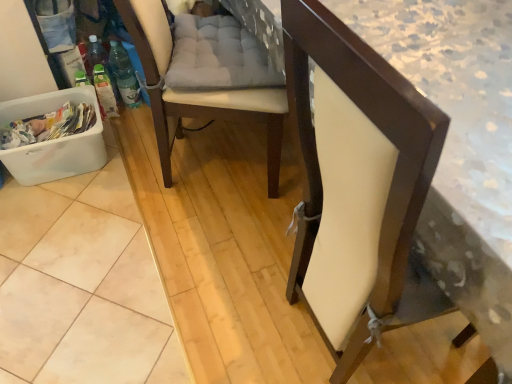
This screenshot has height=384, width=512. Describe the element at coordinates (365, 192) in the screenshot. I see `matte white chair at center, the 2th chair in the left-to-right sequence` at that location.

The width and height of the screenshot is (512, 384). I want to click on white plastic laundry basket at lower left, so click(53, 140).

Which object is further away from the camera, white leather chair at center, which is the first chair from left to right, or matte white chair at center, which is the 1th chair in right-to-left order?

white leather chair at center, which is the first chair from left to right, is more distant.

Could you measure the distance between white leather chair at center, which is the first chair from left to right, and matte white chair at center, the 2th chair in the left-to-right sequence?

white leather chair at center, which is the first chair from left to right, and matte white chair at center, the 2th chair in the left-to-right sequence, are 25.29 inches apart from each other.

From a real-world perspective, between white leather chair at center, which is the first chair from left to right, and matte white chair at center, the 2th chair in the left-to-right sequence, who is vertically lower?

white leather chair at center, which is the first chair from left to right.

Which is farther, (x=240, y=77) or (x=365, y=79)?

The point (x=240, y=77) is farther.

From the image's perspective, between white plastic laundry basket at lower left and white leather chair at center, which is the second chair from right to left, which one is located above?

white leather chair at center, which is the second chair from right to left, appears higher in the image.

From the white plastic laundry basket at lower left, count 1st chairs forward and point to it. Please provide its 2D coordinates.

[(205, 77)]

Is white leather chair at center, which is the first chair from left to right, inside white plastic laundry basket at lower left?

That's incorrect, white leather chair at center, which is the first chair from left to right, is not inside white plastic laundry basket at lower left.

Which object is positioned more to the left, white plastic laundry basket at lower left or white leather chair at center, which is the first chair from left to right?

From the viewer's perspective, white plastic laundry basket at lower left appears more on the left side.

Who is shorter, matte white chair at center, the 2th chair in the left-to-right sequence, or white plastic laundry basket at lower left?

white plastic laundry basket at lower left is shorter.

In order to click on laundry basket behind the matte white chair at center, which is the 1th chair in right-to-left order in this screenshot , I will do `click(53, 140)`.

Who is bigger, matte white chair at center, which is the 1th chair in right-to-left order, or white plastic laundry basket at lower left?

With larger size is matte white chair at center, which is the 1th chair in right-to-left order.

Does matte white chair at center, which is the 1th chair in right-to-left order, turn towards white plastic laundry basket at lower left?

No, matte white chair at center, which is the 1th chair in right-to-left order, is not aimed at white plastic laundry basket at lower left.

Could you tell me if white plastic laundry basket at lower left is facing matte white chair at center, which is the 1th chair in right-to-left order?

No, white plastic laundry basket at lower left is not aimed at matte white chair at center, which is the 1th chair in right-to-left order.

How many degrees apart are the facing directions of white plastic laundry basket at lower left and matte white chair at center, which is the 1th chair in right-to-left order?

87.6 degrees.

Locate an element on the screen. The height and width of the screenshot is (384, 512). laundry basket on the left of the matte white chair at center, which is the 1th chair in right-to-left order is located at coordinates (53, 140).

From the image's perspective, relative to matte white chair at center, the 2th chair in the left-to-right sequence, is white plastic laundry basket at lower left above or below?

white plastic laundry basket at lower left is situated higher than matte white chair at center, the 2th chair in the left-to-right sequence, in the image.

Between matte white chair at center, which is the 1th chair in right-to-left order, and white leather chair at center, which is the second chair from right to left, which one has smaller width?

With smaller width is matte white chair at center, which is the 1th chair in right-to-left order.

From a real-world perspective, who is located higher, matte white chair at center, which is the 1th chair in right-to-left order, or white leather chair at center, which is the first chair from left to right?

From a 3D spatial view, matte white chair at center, which is the 1th chair in right-to-left order, is above.

How different are the orientations of matte white chair at center, the 2th chair in the left-to-right sequence, and white leather chair at center, which is the second chair from right to left, in degrees?

24.4 degrees separate the facing orientations of matte white chair at center, the 2th chair in the left-to-right sequence, and white leather chair at center, which is the second chair from right to left.

In the scene shown: Measure the distance from matte white chair at center, which is the 1th chair in right-to-left order, to white leather chair at center, which is the second chair from right to left.

A distance of 25.29 inches exists between matte white chair at center, which is the 1th chair in right-to-left order, and white leather chair at center, which is the second chair from right to left.

From a real-world perspective, is white leather chair at center, which is the first chair from left to right, physically below white plastic laundry basket at lower left?

No, from a real-world perspective, white leather chair at center, which is the first chair from left to right, is not beneath white plastic laundry basket at lower left.

Relative to white plastic laundry basket at lower left, is white leather chair at center, which is the first chair from left to right, in front or behind?

In the image, white leather chair at center, which is the first chair from left to right, appears in front of white plastic laundry basket at lower left.

From a real-world perspective, which chair is the 1st one above the white plastic laundry basket at lower left? Please provide its 2D coordinates.

[(205, 77)]

Image resolution: width=512 pixels, height=384 pixels. Find the location of `chair below the white leather chair at center, which is the first chair from left to right (from the image's perspective)`. chair below the white leather chair at center, which is the first chair from left to right (from the image's perspective) is located at coordinates (365, 192).

Locate an element on the screen. The image size is (512, 384). laundry basket located underneath the white leather chair at center, which is the first chair from left to right (from a real-world perspective) is located at coordinates (53, 140).

Looking at the image, which one is located further to matte white chair at center, the 2th chair in the left-to-right sequence, white leather chair at center, which is the second chair from right to left, or white plastic laundry basket at lower left?

The object further to matte white chair at center, the 2th chair in the left-to-right sequence, is white plastic laundry basket at lower left.

From the image, which object appears to be farther from white plastic laundry basket at lower left, white leather chair at center, which is the first chair from left to right, or matte white chair at center, the 2th chair in the left-to-right sequence?

Based on the image, matte white chair at center, the 2th chair in the left-to-right sequence, appears to be further to white plastic laundry basket at lower left.

Which object lies nearer to the anchor point white leather chair at center, which is the second chair from right to left, matte white chair at center, which is the 1th chair in right-to-left order, or white plastic laundry basket at lower left?

Among the two, white plastic laundry basket at lower left is located nearer to white leather chair at center, which is the second chair from right to left.

Which object lies further to the anchor point matte white chair at center, the 2th chair in the left-to-right sequence, white plastic laundry basket at lower left or white leather chair at center, which is the first chair from left to right?

Based on the image, white plastic laundry basket at lower left appears to be further to matte white chair at center, the 2th chair in the left-to-right sequence.

From the image, which object appears to be nearer to white leather chair at center, which is the second chair from right to left, white plastic laundry basket at lower left or matte white chair at center, the 2th chair in the left-to-right sequence?

white plastic laundry basket at lower left lies closer to white leather chair at center, which is the second chair from right to left, than the other object.

Which object lies nearer to the anchor point white plastic laundry basket at lower left, matte white chair at center, the 2th chair in the left-to-right sequence, or white leather chair at center, which is the first chair from left to right?

white leather chair at center, which is the first chair from left to right.

Where is `chair between white plastic laundry basket at lower left and matte white chair at center, which is the 1th chair in right-to-left order`? The width and height of the screenshot is (512, 384). chair between white plastic laundry basket at lower left and matte white chair at center, which is the 1th chair in right-to-left order is located at coordinates (205, 77).